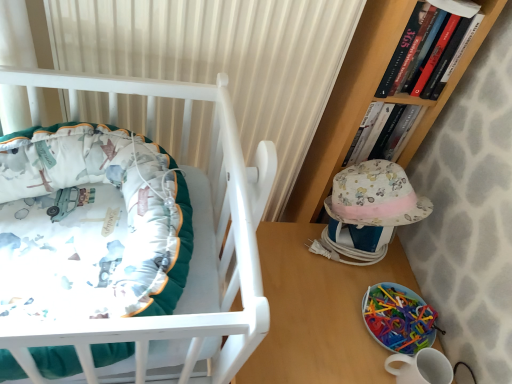
This screenshot has height=384, width=512. Identify the location of vacant point above translucent plastic toy at lower right (from a real-world perspective). (398, 306).